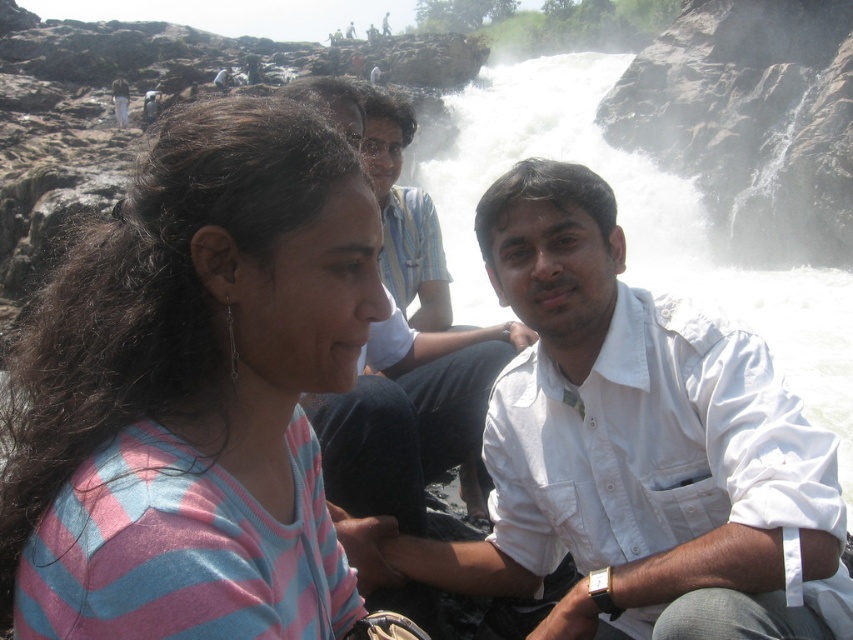
Is pink striped sweater at left behind white shirt at center?

No, it is in front of white shirt at center.

How distant is pink striped sweater at left from white shirt at center?

29.56 feet

Does point (260, 301) come behind point (463, 413)?

No.

Locate an element on the screen. The width and height of the screenshot is (853, 640). pink striped sweater at left is located at coordinates (193, 360).

Which of these two, white cotton shirt at center or white shirt at center, stands shorter?

Standing shorter between the two is white cotton shirt at center.

Does white cotton shirt at center have a greater height compared to white shirt at center?

In fact, white cotton shirt at center may be shorter than white shirt at center.

Locate an element on the screen. The height and width of the screenshot is (640, 853). white cotton shirt at center is located at coordinates (637, 448).

Locate an element on the screen. white cotton shirt at center is located at coordinates (637, 448).

Which of these two, pink striped sweater at left or white cotton shirt at center, stands taller?

white cotton shirt at center

Between point (3, 476) and point (579, 225), which one is positioned behind?

The point (579, 225) is more distant.

Does point (207, 451) come farther from viewer compared to point (798, 605)?

No, (207, 451) is closer to viewer.

This screenshot has width=853, height=640. In order to click on pink striped sweater at left in this screenshot , I will do `click(193, 360)`.